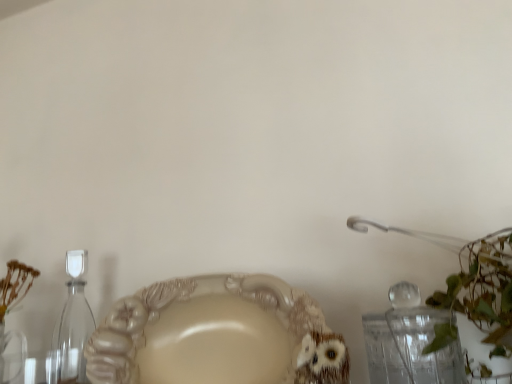
In order to click on matte beige plate at center in this screenshot , I will do `click(216, 335)`.

The image size is (512, 384). What do you see at coordinates (216, 335) in the screenshot? I see `matte beige plate at center` at bounding box center [216, 335].

What do you see at coordinates (72, 326) in the screenshot?
I see `transparent glass hourglass at left` at bounding box center [72, 326].

Locate an element on the screen. This screenshot has width=512, height=384. transparent glass hourglass at left is located at coordinates (72, 326).

Find the location of a particular element. matte beige plate at center is located at coordinates (216, 335).

From the picture: Based on their positions, is transparent glass hourglass at left located to the left or right of matte beige plate at center?

From the image, it's evident that transparent glass hourglass at left is to the left of matte beige plate at center.

Is transparent glass hourglass at left in front of matte beige plate at center?

No, the depth of transparent glass hourglass at left is greater than that of matte beige plate at center.

Is point (52, 356) positioned in front of point (298, 293)?

Yes, it is.

From the image's perspective, between transparent glass hourglass at left and matte beige plate at center, which one is located above?

matte beige plate at center.

From a real-world perspective, is transparent glass hourglass at left positioned above or below matte beige plate at center?

Clearly, from a real-world perspective, transparent glass hourglass at left is above matte beige plate at center.

Considering the sizes of objects transparent glass hourglass at left and matte beige plate at center in the image provided, who is wider, transparent glass hourglass at left or matte beige plate at center?

matte beige plate at center is wider.

Which of these two, transparent glass hourglass at left or matte beige plate at center, stands taller?

With more height is transparent glass hourglass at left.

Considering the sizes of transparent glass hourglass at left and matte beige plate at center in the image, is transparent glass hourglass at left bigger or smaller than matte beige plate at center?

transparent glass hourglass at left is smaller than matte beige plate at center.

Is transparent glass hourglass at left positioned beyond the bounds of matte beige plate at center?

Absolutely, transparent glass hourglass at left is external to matte beige plate at center.

Is transparent glass hourglass at left directly adjacent to matte beige plate at center?

transparent glass hourglass at left and matte beige plate at center are not in contact.

Could you tell me if transparent glass hourglass at left is turned towards matte beige plate at center?

No, transparent glass hourglass at left is not oriented towards matte beige plate at center.

What's the angular difference between transparent glass hourglass at left and matte beige plate at center's facing directions?

There is a 3.7-degree angle between the facing directions of transparent glass hourglass at left and matte beige plate at center.

How distant is transparent glass hourglass at left from matte beige plate at center?

transparent glass hourglass at left is 9.36 inches from matte beige plate at center.

The width and height of the screenshot is (512, 384). Identify the location of plate on the right side of transparent glass hourglass at left. (216, 335).

Would you say matte beige plate at center is to the left or to the right of transparent glass hourglass at left in the picture?

Based on their positions, matte beige plate at center is located to the right of transparent glass hourglass at left.

In the scene shown: Does matte beige plate at center come behind transparent glass hourglass at left?

No, it is in front of transparent glass hourglass at left.

Considering the points (229, 364) and (67, 376), which point is behind, point (229, 364) or point (67, 376)?

Positioned behind is point (67, 376).

From the image's perspective, who appears lower, matte beige plate at center or transparent glass hourglass at left?

transparent glass hourglass at left.

From a real-world perspective, is matte beige plate at center on top of transparent glass hourglass at left?

Incorrect, from a real-world perspective, matte beige plate at center is lower than transparent glass hourglass at left.

Which object is wider, matte beige plate at center or transparent glass hourglass at left?

matte beige plate at center.

From the picture: From their relative heights in the image, would you say matte beige plate at center is taller or shorter than transparent glass hourglass at left?

Considering their sizes, matte beige plate at center has less height than transparent glass hourglass at left.

Consider the image. Can you confirm if matte beige plate at center is bigger than transparent glass hourglass at left?

Yes, matte beige plate at center is bigger than transparent glass hourglass at left.

Is matte beige plate at center outside of transparent glass hourglass at left?

Yes.

Are matte beige plate at center and transparent glass hourglass at left beside each other?

matte beige plate at center and transparent glass hourglass at left are clearly separated.

Is matte beige plate at center looking in the opposite direction of transparent glass hourglass at left?

matte beige plate at center is not turned away from transparent glass hourglass at left.

Looking at this image, how different are the orientations of matte beige plate at center and transparent glass hourglass at left in degrees?

The angular difference between matte beige plate at center and transparent glass hourglass at left is 3.7 degrees.

Locate an element on the screen. The height and width of the screenshot is (384, 512). plate below the transparent glass hourglass at left (from a real-world perspective) is located at coordinates (216, 335).

Where is `plate above the transparent glass hourglass at left (from the image's perspective)`? This screenshot has height=384, width=512. plate above the transparent glass hourglass at left (from the image's perspective) is located at coordinates [216, 335].

You are a GUI agent. You are given a task and a screenshot of the screen. Output one action in this format:
    pyautogui.click(x=<x>, y=<y>)
    Task: Click on the bottle located above the matte beige plate at center (from a real-world perspective)
    This screenshot has height=384, width=512.
    Given the screenshot: What is the action you would take?
    pyautogui.click(x=72, y=326)